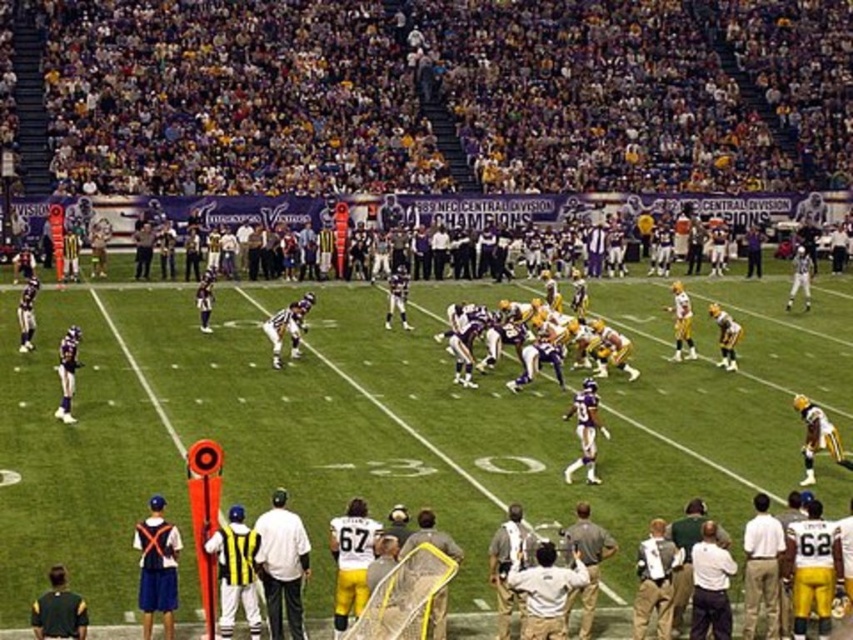
Question: Is dark purple jersey at upper center wider than white matte shirt at center?

Choices:
 (A) no
 (B) yes

Answer: (B)

Question: Does dark purple jersey at upper center have a larger size compared to white matte shirt at center?

Choices:
 (A) no
 (B) yes

Answer: (B)

Question: Among these points, which one is farthest from the camera?

Choices:
 (A) (299, 573)
 (B) (199, 129)

Answer: (B)

Question: Considering the relative positions of dark purple jersey at upper center and white matte shirt at center in the image provided, where is dark purple jersey at upper center located with respect to white matte shirt at center?

Choices:
 (A) left
 (B) right

Answer: (B)

Question: Which point is closer to the camera taking this photo?

Choices:
 (A) (305, 572)
 (B) (55, 106)

Answer: (A)

Question: Among these objects, which one is farthest from the camera?

Choices:
 (A) dark purple jersey at upper center
 (B) white matte shirt at center

Answer: (A)